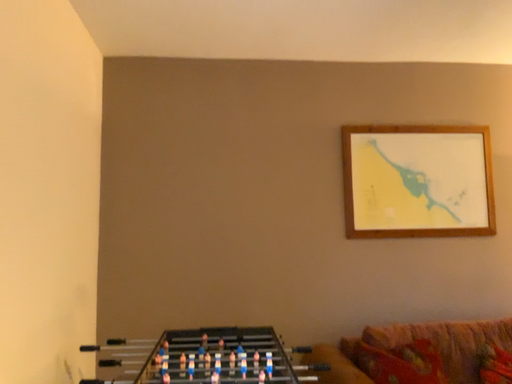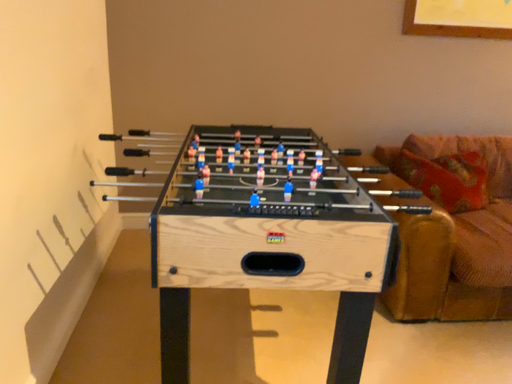
Question: Which way did the camera rotate in the video?

Choices:
 (A) rotated downward
 (B) rotated upward

Answer: (A)